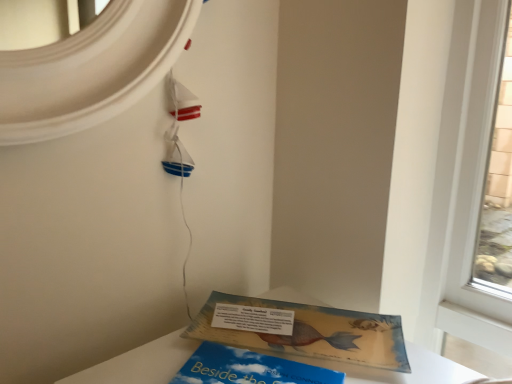
Question: Can you confirm if blue matte book at lower center, marked as the 1th book in a front-to-back arrangement, is positioned to the left of matte yellow book at lower center, the second book viewed from the front?

Choices:
 (A) yes
 (B) no

Answer: (A)

Question: Is blue matte book at lower center, acting as the 2th book starting from the back, shorter than matte yellow book at lower center, which appears as the 1th book when viewed from the back?

Choices:
 (A) no
 (B) yes

Answer: (A)

Question: Can you confirm if blue matte book at lower center, acting as the 2th book starting from the back, is bigger than matte yellow book at lower center, which appears as the 1th book when viewed from the back?

Choices:
 (A) yes
 (B) no

Answer: (B)

Question: Is blue matte book at lower center, marked as the 1th book in a front-to-back arrangement, outside of matte yellow book at lower center, which appears as the 1th book when viewed from the back?

Choices:
 (A) no
 (B) yes

Answer: (B)

Question: From a real-world perspective, is blue matte book at lower center, marked as the 1th book in a front-to-back arrangement, on matte yellow book at lower center, which appears as the 1th book when viewed from the back?

Choices:
 (A) yes
 (B) no

Answer: (B)

Question: From the image's perspective, is blue matte book at lower center, marked as the 1th book in a front-to-back arrangement, located above matte yellow book at lower center, the second book viewed from the front?

Choices:
 (A) yes
 (B) no

Answer: (B)

Question: Is matte yellow book at lower center, which appears as the 1th book when viewed from the back, behind white paper at lower center?

Choices:
 (A) no
 (B) yes

Answer: (A)

Question: Considering the relative sizes of matte yellow book at lower center, the second book viewed from the front, and white paper at lower center in the image provided, is matte yellow book at lower center, the second book viewed from the front, shorter than white paper at lower center?

Choices:
 (A) yes
 (B) no

Answer: (A)

Question: From a real-world perspective, is matte yellow book at lower center, the second book viewed from the front, on white paper at lower center?

Choices:
 (A) yes
 (B) no

Answer: (B)

Question: Does matte yellow book at lower center, which appears as the 1th book when viewed from the back, have a larger size compared to white paper at lower center?

Choices:
 (A) no
 (B) yes

Answer: (B)

Question: Does matte yellow book at lower center, which appears as the 1th book when viewed from the back, have a greater height compared to white paper at lower center?

Choices:
 (A) yes
 (B) no

Answer: (B)

Question: Is matte yellow book at lower center, the second book viewed from the front, oriented away from white paper at lower center?

Choices:
 (A) no
 (B) yes

Answer: (B)

Question: Is blue matte book at lower center, acting as the 2th book starting from the back, positioned beyond the bounds of white paper at lower center?

Choices:
 (A) yes
 (B) no

Answer: (A)